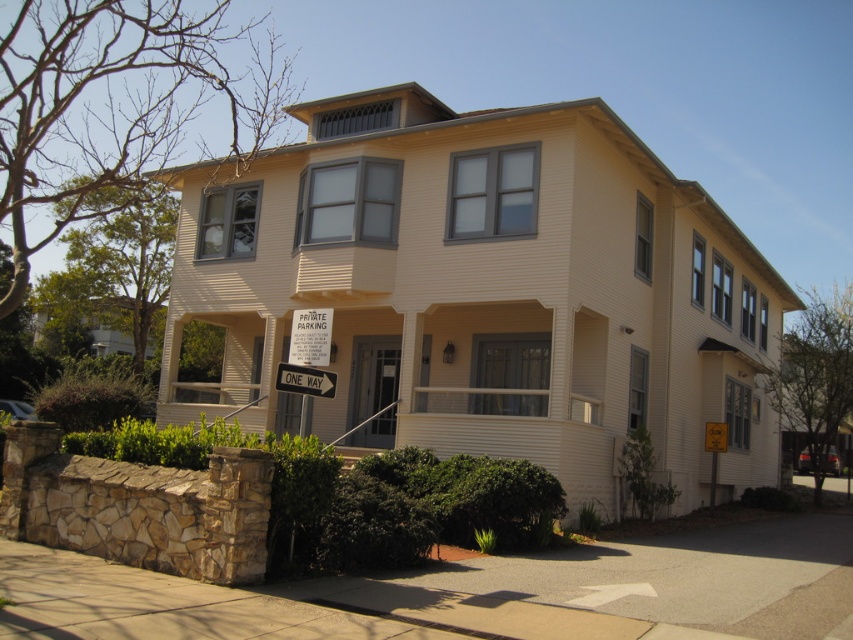
From the picture: Does white painted wood trim at upper center appear over white plastic one way sign at center?

Indeed, white painted wood trim at upper center is positioned over white plastic one way sign at center.

Locate an element on the screen. The width and height of the screenshot is (853, 640). white painted wood trim at upper center is located at coordinates (485, 291).

At what (x,y) coordinates should I click in order to perform the action: click on white painted wood trim at upper center. Please return your answer as a coordinate pair (x, y). The width and height of the screenshot is (853, 640). Looking at the image, I should click on (485, 291).